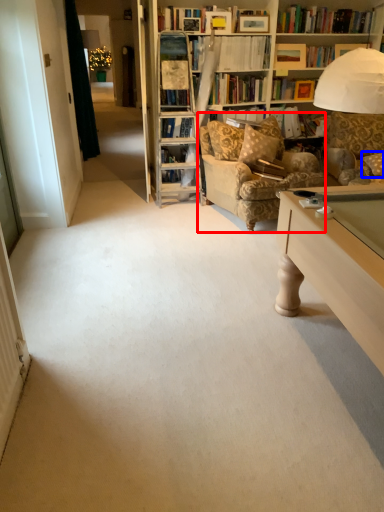
Question: Which of the following is the closest to the observer, chair (highlighted by a red box) or pillow (highlighted by a blue box)?

Choices:
 (A) chair
 (B) pillow

Answer: (A)